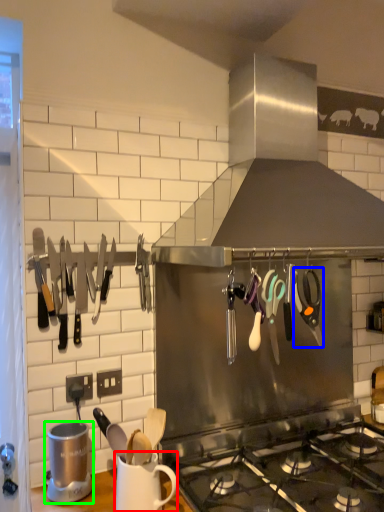
Question: Which object is the farthest from mug (highlighted by a red box)? Choose among these: scissors (highlighted by a blue box) or appliance (highlighted by a green box).

Choices:
 (A) scissors
 (B) appliance

Answer: (A)